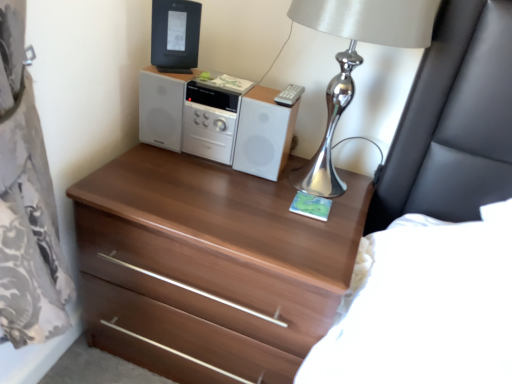
Question: Considering the relative sizes of walnut wood chest of drawers at center and black plastic desktop computer at upper center in the image provided, is walnut wood chest of drawers at center smaller than black plastic desktop computer at upper center?

Choices:
 (A) yes
 (B) no

Answer: (B)

Question: Is walnut wood chest of drawers at center located outside black plastic desktop computer at upper center?

Choices:
 (A) no
 (B) yes

Answer: (B)

Question: From a real-world perspective, is walnut wood chest of drawers at center positioned over black plastic desktop computer at upper center based on gravity?

Choices:
 (A) yes
 (B) no

Answer: (B)

Question: Is there a large distance between walnut wood chest of drawers at center and black plastic desktop computer at upper center?

Choices:
 (A) yes
 (B) no

Answer: (B)

Question: From a real-world perspective, is walnut wood chest of drawers at center positioned under black plastic desktop computer at upper center based on gravity?

Choices:
 (A) yes
 (B) no

Answer: (A)

Question: Is walnut wood chest of drawers at center looking in the opposite direction of black plastic desktop computer at upper center?

Choices:
 (A) no
 (B) yes

Answer: (A)

Question: Is white glossy stereo at center next to walnut wood chest of drawers at center?

Choices:
 (A) no
 (B) yes

Answer: (A)

Question: From the image's perspective, is white glossy stereo at center below walnut wood chest of drawers at center?

Choices:
 (A) yes
 (B) no

Answer: (B)

Question: Is white glossy stereo at center oriented away from walnut wood chest of drawers at center?

Choices:
 (A) yes
 (B) no

Answer: (B)

Question: From the image's perspective, does white glossy stereo at center appear higher than walnut wood chest of drawers at center?

Choices:
 (A) no
 (B) yes

Answer: (B)

Question: From a real-world perspective, is white glossy stereo at center on top of walnut wood chest of drawers at center?

Choices:
 (A) yes
 (B) no

Answer: (A)

Question: Does white glossy stereo at center lie in front of walnut wood chest of drawers at center?

Choices:
 (A) no
 (B) yes

Answer: (A)

Question: Considering the relative positions of silver metallic table lamp at upper right and black plastic desktop computer at upper center in the image provided, is silver metallic table lamp at upper right to the right of black plastic desktop computer at upper center from the viewer's perspective?

Choices:
 (A) yes
 (B) no

Answer: (A)